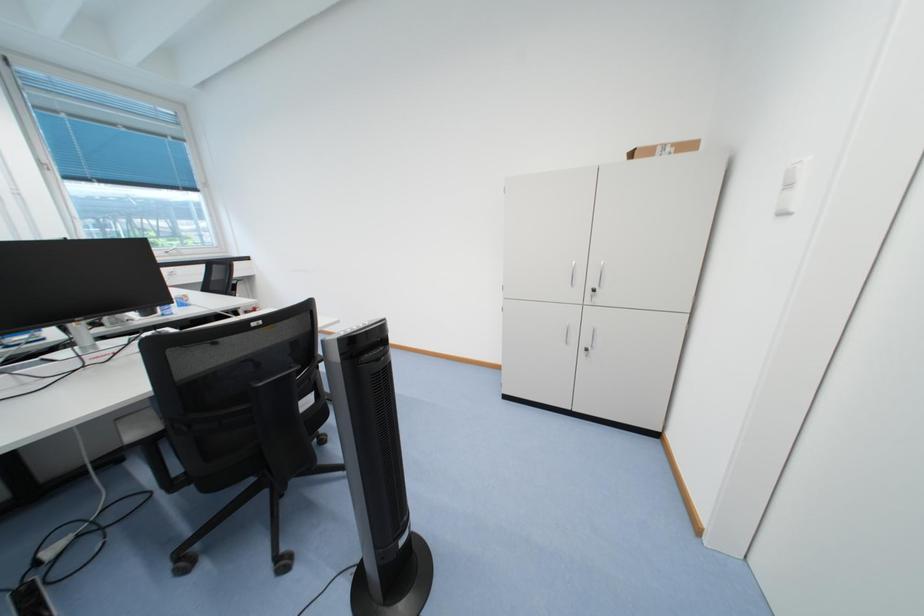
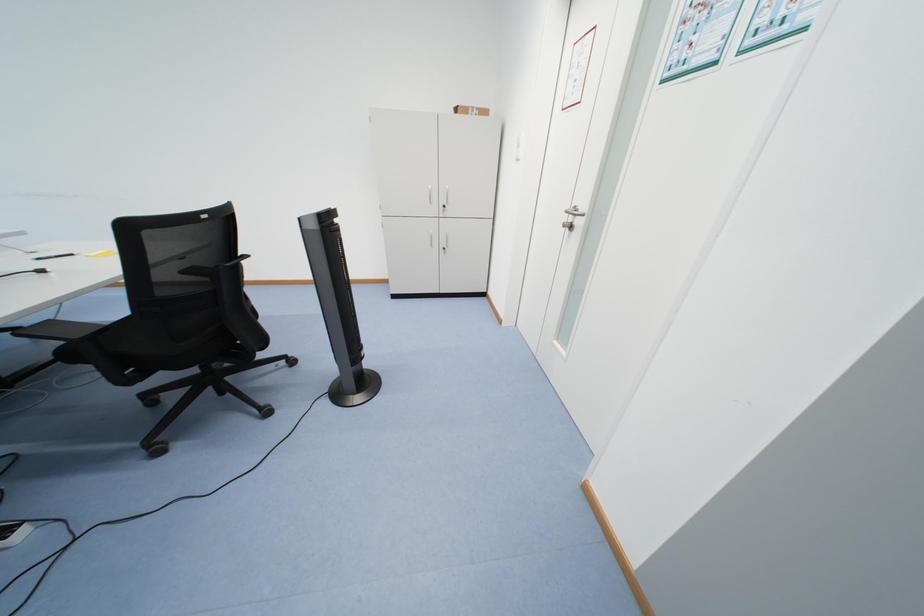
Question: How did the camera likely rotate?

Choices:
 (A) Left
 (B) Right
 (C) Up
 (D) Down

Answer: (B)